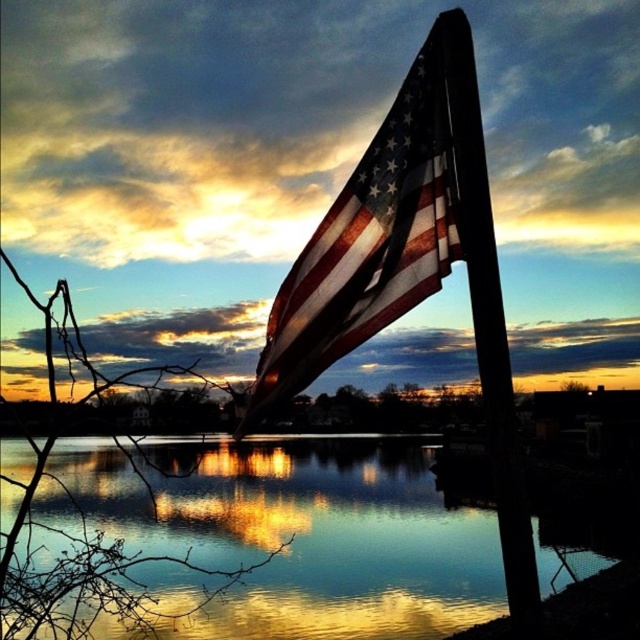
Question: Considering the relative positions of reflective glass water at center and worn fabric flag at upper center in the image provided, where is reflective glass water at center located with respect to worn fabric flag at upper center?

Choices:
 (A) below
 (B) above

Answer: (A)

Question: Which object is closer to the camera taking this photo?

Choices:
 (A) reflective glass water at center
 (B) smooth wood flag pole at center

Answer: (A)

Question: Is reflective glass water at center behind worn fabric flag at upper center?

Choices:
 (A) no
 (B) yes

Answer: (A)

Question: Which object appears farthest from the camera in this image?

Choices:
 (A) worn fabric flag at upper center
 (B) smooth wood flag pole at center

Answer: (A)

Question: Can you confirm if reflective glass water at center is smaller than smooth wood flag pole at center?

Choices:
 (A) yes
 (B) no

Answer: (B)

Question: Which point appears farthest from the camera in this image?

Choices:
 (A) (496, 275)
 (B) (224, 522)

Answer: (B)